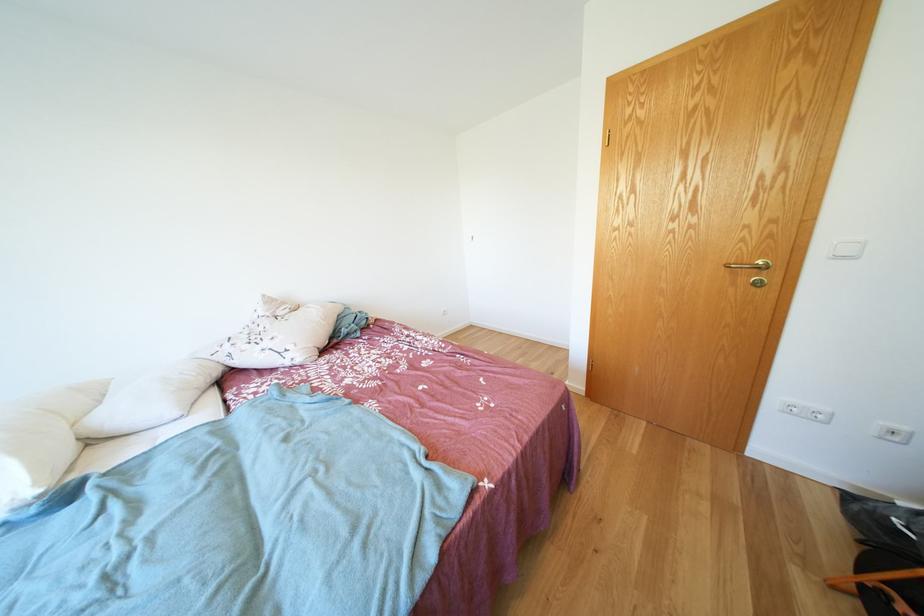
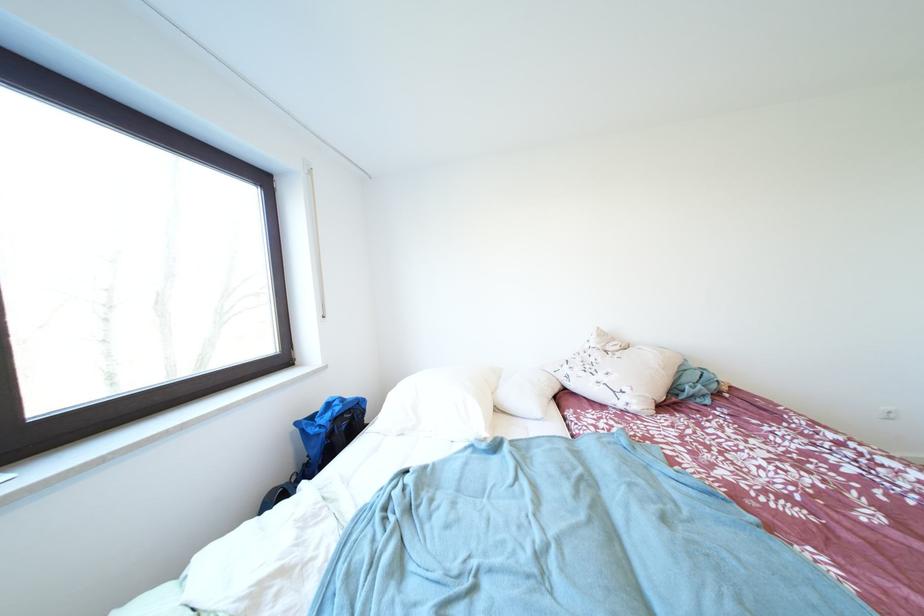
Locate, in the second image, the point that corresponds to point (273, 300) in the first image.

(606, 333)